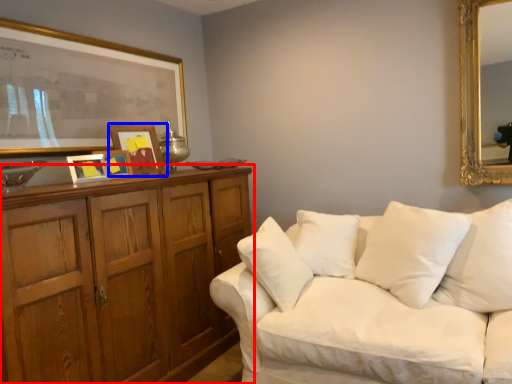
Question: Which point is further to the camera, cabinetry (highlighted by a red box) or picture frame (highlighted by a blue box)?

Choices:
 (A) cabinetry
 (B) picture frame

Answer: (B)